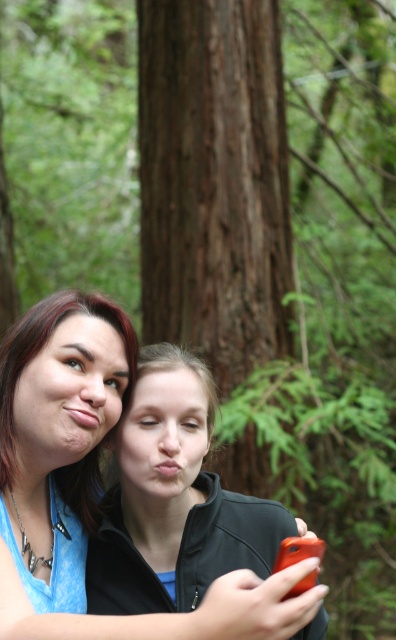
Between brown rough tree trunk at center and matte blue shirt at left, which one is positioned higher?

brown rough tree trunk at center is higher up.

The height and width of the screenshot is (640, 396). In order to click on brown rough tree trunk at center in this screenshot , I will do `click(213, 180)`.

Does brown rough tree trunk at center have a greater width compared to matte blue shirt at lower left?

Yes, brown rough tree trunk at center is wider than matte blue shirt at lower left.

Between point (283, 212) and point (24, 394), which one is positioned in front?

Point (24, 394) is in front.

Locate an element on the screen. This screenshot has width=396, height=640. brown rough tree trunk at center is located at coordinates (213, 180).

Is matte blue shirt at lower left smaller than matte blue shirt at left?

Incorrect, matte blue shirt at lower left is not smaller in size than matte blue shirt at left.

The width and height of the screenshot is (396, 640). What do you see at coordinates (93, 486) in the screenshot? I see `matte blue shirt at lower left` at bounding box center [93, 486].

Locate an element on the screen. matte blue shirt at lower left is located at coordinates (93, 486).